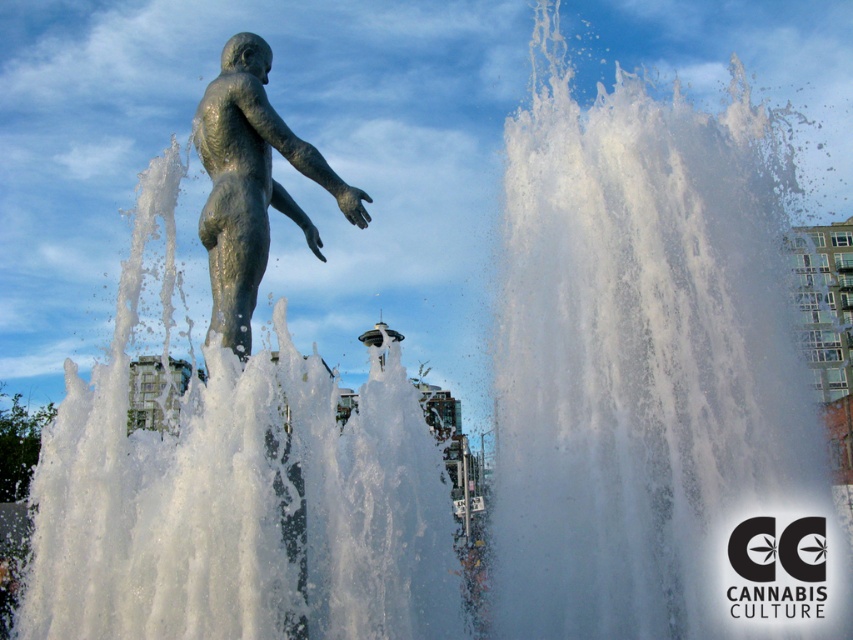
Question: Which point is closer to the camera?

Choices:
 (A) (749, 102)
 (B) (212, 163)

Answer: (B)

Question: Can you confirm if clear water at center is positioned to the right of bronze textured statue at center?

Choices:
 (A) no
 (B) yes

Answer: (B)

Question: Is clear water at center closer to the viewer compared to bronze textured statue at center?

Choices:
 (A) no
 (B) yes

Answer: (A)

Question: Is clear water at center positioned at the back of bronze textured statue at center?

Choices:
 (A) yes
 (B) no

Answer: (A)